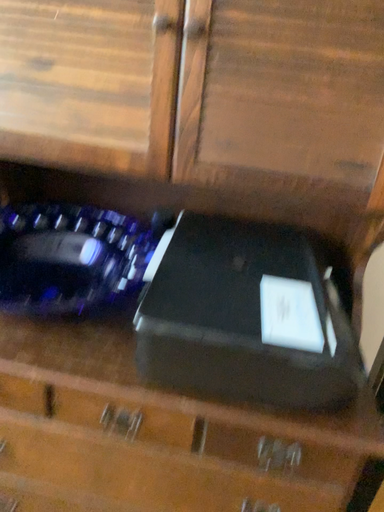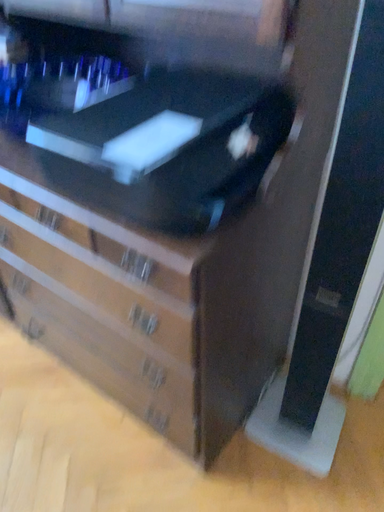
Question: How did the camera likely rotate when shooting the video?

Choices:
 (A) rotated left
 (B) rotated right

Answer: (A)